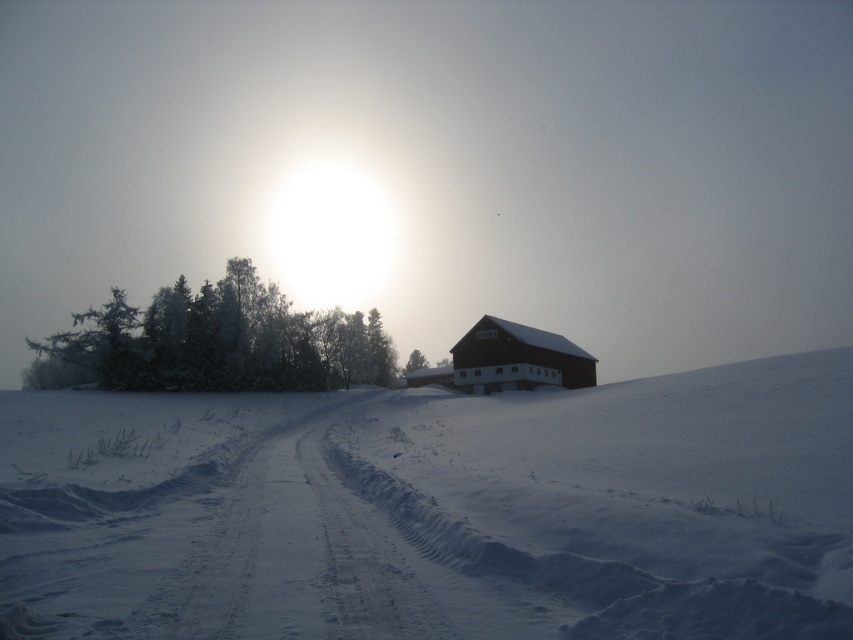
You are standing in the winter landscape and see the white powdery snow at center and the dark brown wooden barn at center. Which object is closer to the ground?

The white powdery snow at center is positioned under the dark brown wooden barn at center, so it is closer to the ground.